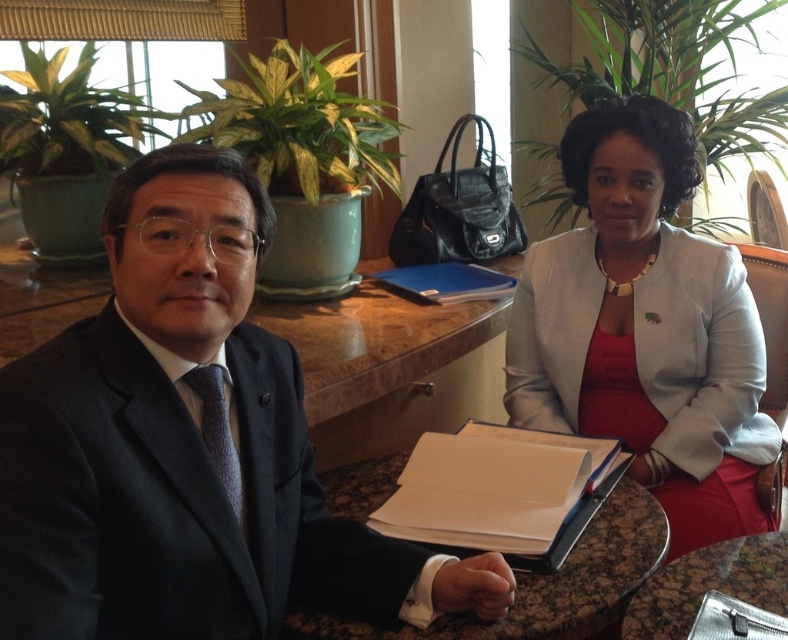
Is dark blue suit at center to the right of dark brown textured tie at left from the viewer's perspective?

In fact, dark blue suit at center is to the left of dark brown textured tie at left.

Is point (45, 401) more distant than point (240, 504)?

No, (45, 401) is in front of (240, 504).

This screenshot has height=640, width=788. I want to click on dark blue suit at center, so click(x=186, y=448).

Can you confirm if dark blue suit at center is positioned to the right of brown marble table at center?

In fact, dark blue suit at center is to the left of brown marble table at center.

Which is above, dark blue suit at center or brown marble table at center?

dark blue suit at center is above.

Find the location of `dark blue suit at center`. dark blue suit at center is located at coordinates (186, 448).

You are a GUI agent. You are given a task and a screenshot of the screen. Output one action in this format:
    pyautogui.click(x=<x>, y=<y>)
    Task: Click on the dark blue suit at center
    
    Given the screenshot: What is the action you would take?
    pyautogui.click(x=186, y=448)

Describe the element at coordinates (645, 326) in the screenshot. I see `white matte blazer at center` at that location.

Is point (601, 140) closer to camera compared to point (653, 634)?

No, it is behind (653, 634).

What are the coordinates of `white matte blazer at center` in the screenshot? It's located at (645, 326).